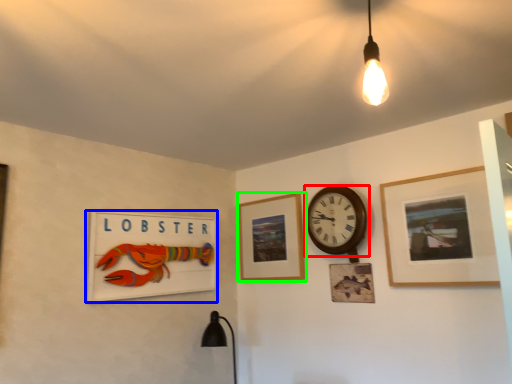
Question: Which is farther away from wall clock (highlighted by a red box)? picture frame (highlighted by a blue box) or picture frame (highlighted by a green box)?

Choices:
 (A) picture frame
 (B) picture frame

Answer: (A)